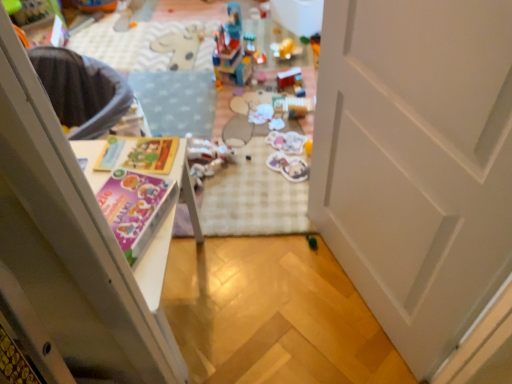
At what (x,y) coordinates should I click in order to perform the action: click on vacant space in front of translucent plastic stickers at center, the 4th toy from the bottom. Please return your answer as a coordinate pair (x, y). Looking at the image, I should click on (281, 166).